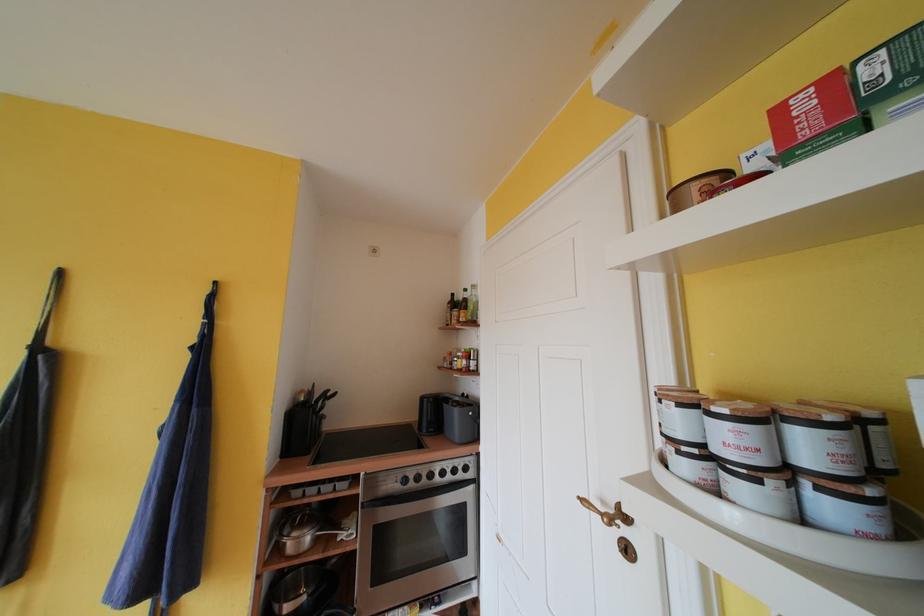
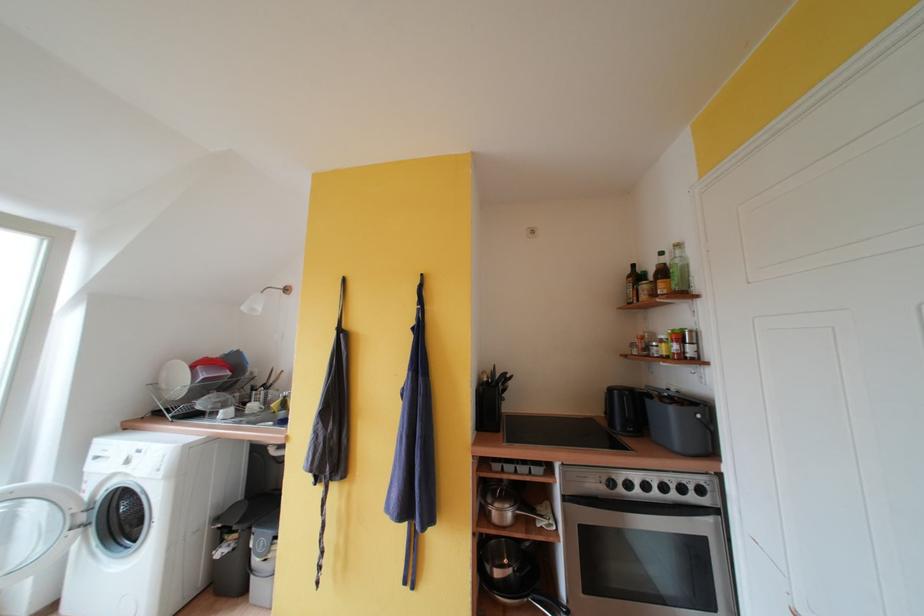
In the second image, find the point that corresponds to point 345,543 in the first image.

(544, 529)